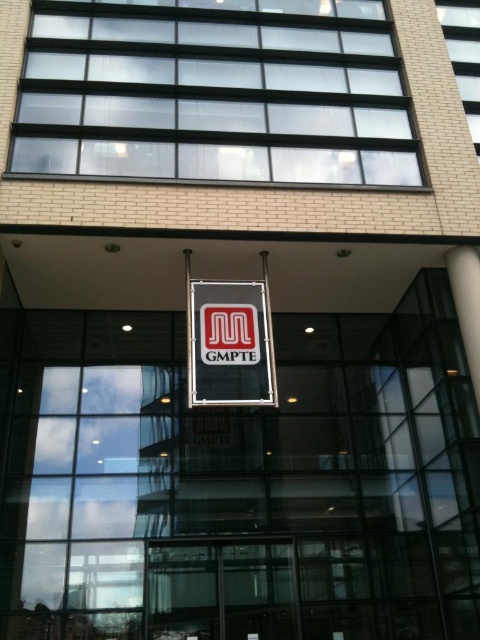
Question: Can you confirm if matte black sign at center is bigger than white glossy pillar at right?

Choices:
 (A) yes
 (B) no

Answer: (A)

Question: Is matte black sign at center to the left of white glossy pillar at right from the viewer's perspective?

Choices:
 (A) no
 (B) yes

Answer: (B)

Question: Can you confirm if matte black sign at center is thinner than white glossy pillar at right?

Choices:
 (A) yes
 (B) no

Answer: (B)

Question: Which of the following is the farthest from the observer?

Choices:
 (A) (460, 280)
 (B) (250, 308)

Answer: (A)